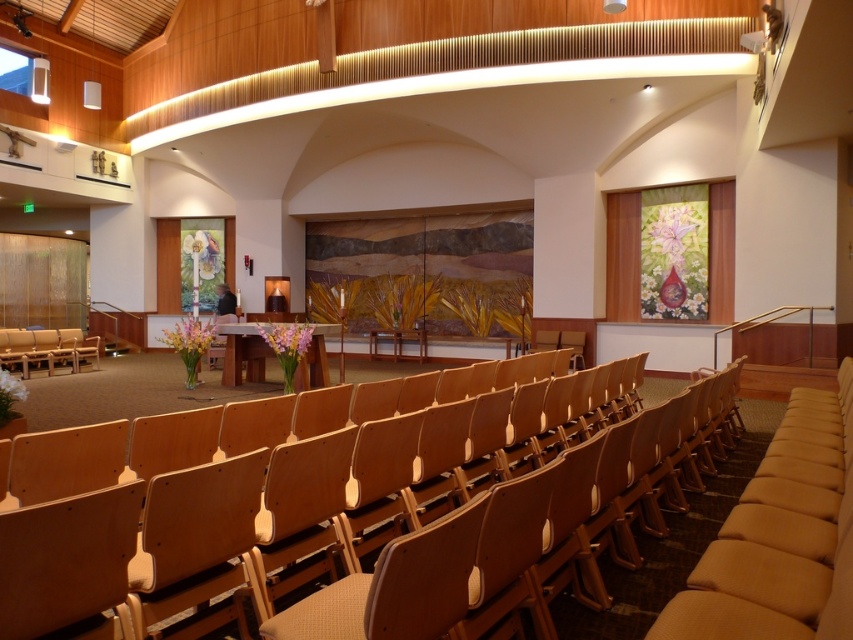
You are a GUI agent. You are given a task and a screenshot of the screen. Output one action in this format:
    pyautogui.click(x=<x>, y=<y>)
    Task: Click on the light brown wood chair at center
    
    Given the screenshot: What is the action you would take?
    (x=274, y=516)

Is point (317, 522) closer to camera compared to point (9, 352)?

Yes, point (317, 522) is closer to viewer.

At what (x,y) coordinates should I click in order to perform the action: click on light brown wood chair at center. Please return your answer as a coordinate pair (x, y). This screenshot has height=640, width=853. Looking at the image, I should click on (274, 516).